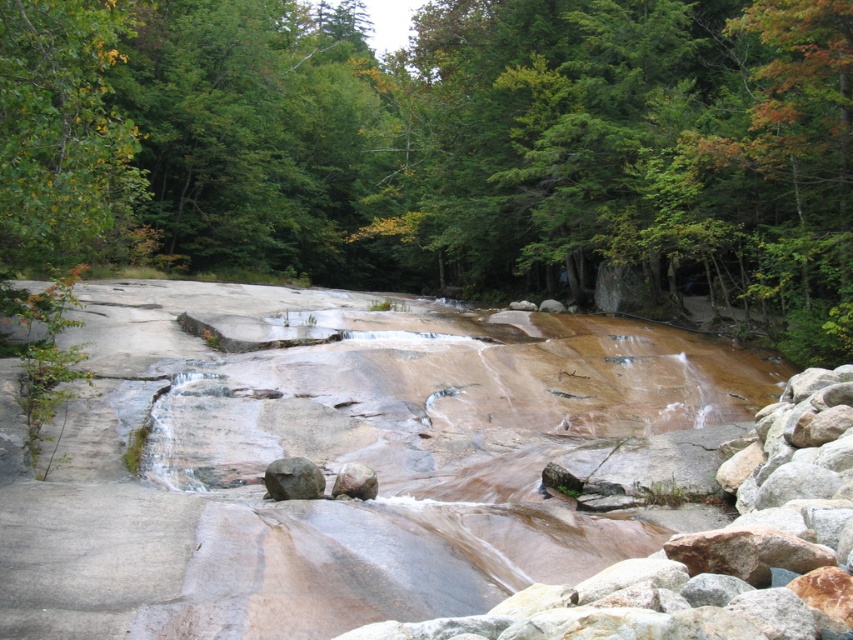
You are a hiker trying to cross the stream by stepping on the rocks. You have a backpack that requires a stable surface. Which rock should you choose between the smooth brown rock at center and the smooth gray rock at center?

The smooth brown rock at center is taller than the smooth gray rock at center, so it provides a more stable surface for stepping on while crossing the stream.

You are a hiker who wants to cross the stream using the rocks. You have a backpack that requires a minimum of 1 meter of width to safely step on. Which rock between the smooth brown rock at center and the smooth gray rock at center should you choose?

The smooth brown rock at center has a larger width than the smooth gray rock at center, so you should choose the smooth brown rock at center as it is wider and meets the minimum width requirement for safely stepping on with your backpack.

You are standing at the point with coordinates point (x=62, y=132) in the scene. What object are you located on?

You are located on the green leafy tree at upper left.